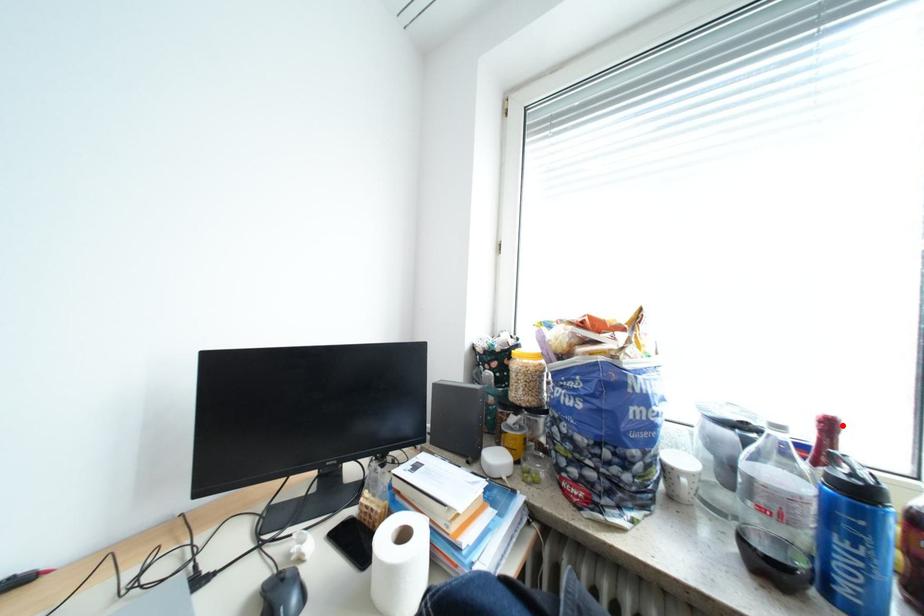
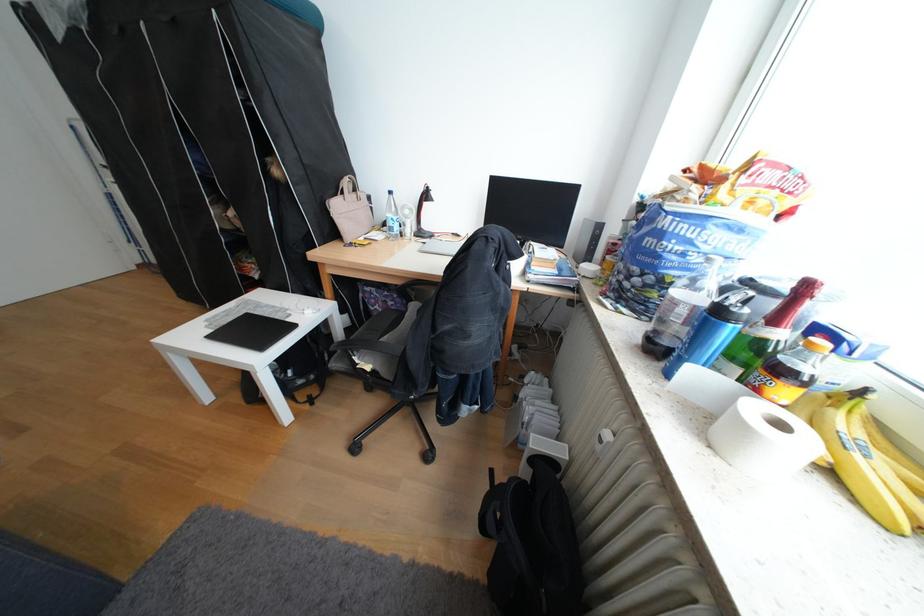
Locate, in the second image, the point that corresponds to the highlighted location in the first image.

(819, 288)